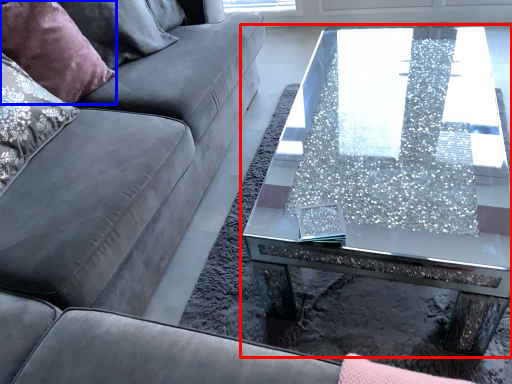
Question: Which point is further to the camera, coffee table (highlighted by a red box) or pillow (highlighted by a blue box)?

Choices:
 (A) coffee table
 (B) pillow

Answer: (B)